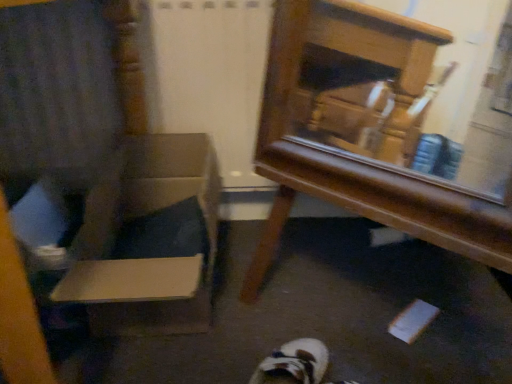
Question: Is cardboard box at left to the left or to the right of wooden mirror at center in the image?

Choices:
 (A) left
 (B) right

Answer: (A)

Question: Is cardboard box at left wider or thinner than wooden mirror at center?

Choices:
 (A) thin
 (B) wide

Answer: (B)

Question: Estimate the real-world distances between objects in this image. Which object is farther from the wooden armchair at left?

Choices:
 (A) cardboard box at left
 (B) wooden mirror at center

Answer: (B)

Question: Which object is positioned farthest from the cardboard box at left?

Choices:
 (A) wooden armchair at left
 (B) wooden mirror at center

Answer: (B)